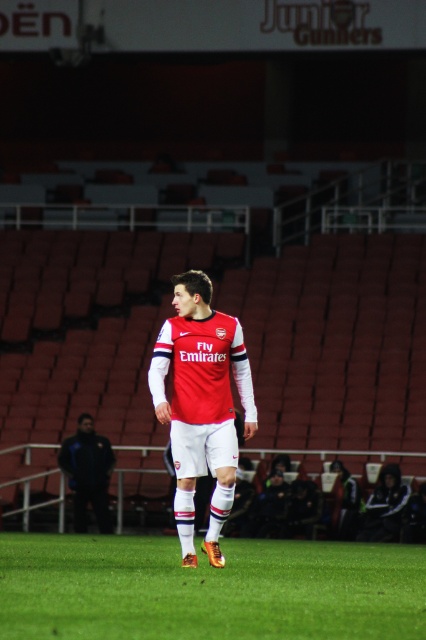
You are a photographer at the soccer field. You need to capture a clear photo of the matte red jersey at center and the dark blue jacket at lower left. Which object is covering part of the other?

The matte red jersey at center is positioned over dark blue jacket at lower left, so the matte red jersey at center is covering part of the dark blue jacket at lower left.

You are a photographer standing at the edge of the soccer field. You want to take a photo of the matte red jersey at center and the dark blue jacket at lower left, but your camera can only focus on objects within a 10 meter range. Can you capture both subjects in focus without moving?

The distance between the matte red jersey at center and the dark blue jacket at lower left is 10.33 meters, which exceeds the camera focus range of 10 meters. Therefore, you cannot capture both subjects in focus without moving.